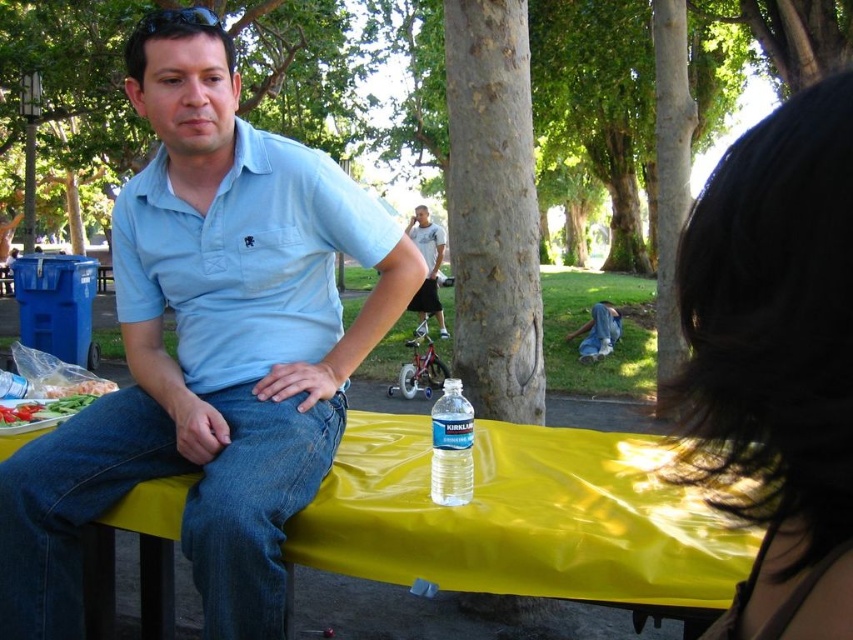
Which is below, dark brown hair at upper right or light blue shirt at center?

Positioned lower is dark brown hair at upper right.

Does point (833, 140) come farther from viewer compared to point (425, 227)?

No, it is in front of (425, 227).

Measure the distance between dark brown hair at upper right and camera.

14.15 inches

At what (x,y) coordinates should I click in order to perform the action: click on dark brown hair at upper right. Please return your answer as a coordinate pair (x, y). The height and width of the screenshot is (640, 853). Looking at the image, I should click on (776, 358).

Is clear plastic water bottle at center shorter than light blue shirt at center?

Indeed, clear plastic water bottle at center has a lesser height compared to light blue shirt at center.

Is the position of clear plastic water bottle at center less distant than that of light blue shirt at center?

Yes.

Between point (450, 476) and point (431, 259), which one is positioned in front?

Positioned in front is point (450, 476).

Image resolution: width=853 pixels, height=640 pixels. Find the location of `clear plastic water bottle at center`. clear plastic water bottle at center is located at coordinates (451, 445).

At what (x,y) coordinates should I click in order to perform the action: click on denim jeans at lower left. Please return your answer as a coordinate pair (x, y). The image size is (853, 640). Looking at the image, I should click on (183, 515).

Does point (192, 520) come closer to viewer compared to point (579, 348)?

Yes, point (192, 520) is closer to viewer.

Identify the location of denim jeans at lower left. This screenshot has width=853, height=640. (183, 515).